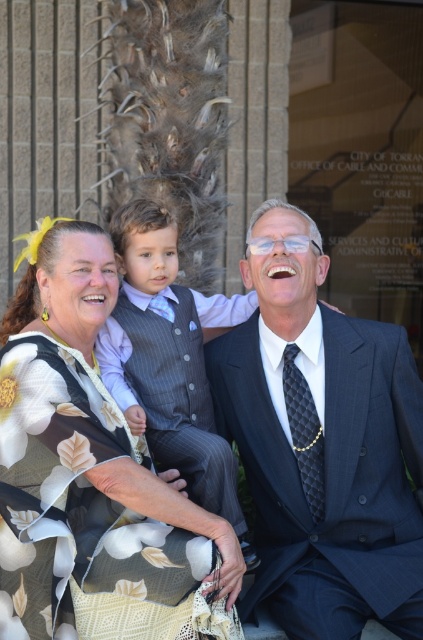
Based on the scene description, which object is bigger between the floral fabric dress at center and the gray pinstripe vest at center?

The floral fabric dress at center is larger in size than the gray pinstripe vest at center.